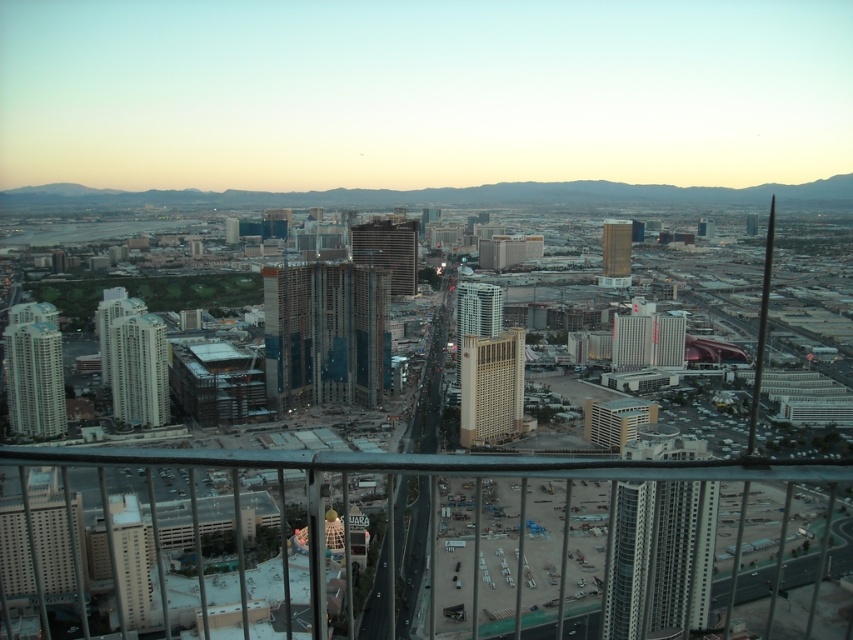
You are standing on the observation deck of a building and see a point marked at coordinates (33,371). Which object in the scene does this point belong to?

The point at coordinates (33,371) is on the matte glass skyscraper at left.

You are standing at the observation deck and want to take a photo of both the glassy steel skyscraper at center and the metallic glass skyscraper at center. Which one will appear taller in the photo?

The glassy steel skyscraper at center will appear taller in the photo because it is much taller than the metallic glass skyscraper at center.